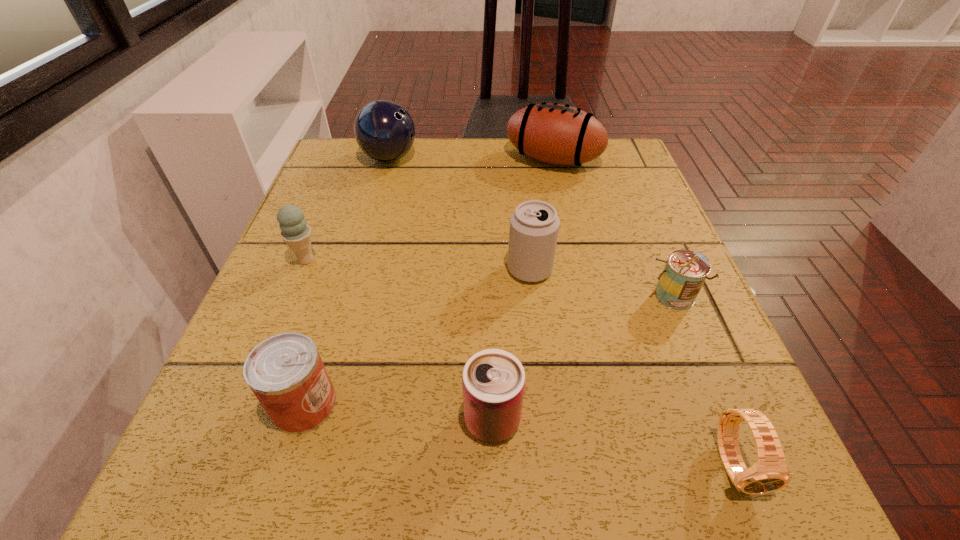
The image size is (960, 540). What are the coordinates of `watch present at the right edge` in the screenshot? It's located at click(769, 473).

I want to click on object positioned at the far left corner, so click(384, 130).

I want to click on object that is at the far right corner, so [557, 134].

Identify the location of object present at the near right corner. Image resolution: width=960 pixels, height=540 pixels. (769, 473).

Identify the location of free point at the far edge. (416, 186).

In the image, there is a desktop. At what (x,y) coordinates should I click in order to perform the action: click on vacant space at the near edge. Please return your answer as a coordinate pair (x, y). The image size is (960, 540). Looking at the image, I should click on (616, 443).

Identify the location of vacant space at the left edge. This screenshot has height=540, width=960. (339, 202).

Identify the location of free region at the right edge of the desktop. (612, 234).

Find the location of a particular element. Image resolution: width=960 pixels, height=540 pixels. vacant space at the far left corner of the desktop is located at coordinates (323, 164).

At what (x,y) coordinates should I click in order to perform the action: click on free location at the near right corner. Please return your answer as a coordinate pair (x, y). The width and height of the screenshot is (960, 540). Looking at the image, I should click on (697, 483).